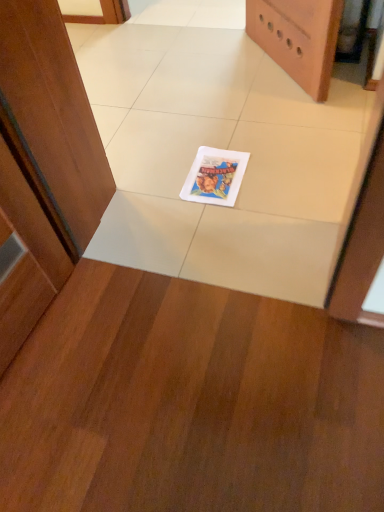
Question: Would you say white glossy tile at center is to the left or to the right of matte white comic book at center in the picture?

Choices:
 (A) left
 (B) right

Answer: (A)

Question: Considering the positions of point (124, 47) and point (240, 184), is point (124, 47) closer or farther from the camera than point (240, 184)?

Choices:
 (A) closer
 (B) farther

Answer: (B)

Question: Considering the positions of white glossy tile at center and matte white comic book at center in the image, is white glossy tile at center wider or thinner than matte white comic book at center?

Choices:
 (A) wide
 (B) thin

Answer: (A)

Question: Would you say matte white comic book at center is inside or outside white glossy tile at center?

Choices:
 (A) outside
 (B) inside

Answer: (B)

Question: Does point (203, 159) appear closer or farther from the camera than point (256, 220)?

Choices:
 (A) closer
 (B) farther

Answer: (B)

Question: From a real-world perspective, is matte white comic book at center physically located above or below white glossy tile at center?

Choices:
 (A) below
 (B) above

Answer: (B)

Question: In the image, is matte white comic book at center positioned in front of or behind white glossy tile at center?

Choices:
 (A) behind
 (B) front

Answer: (A)